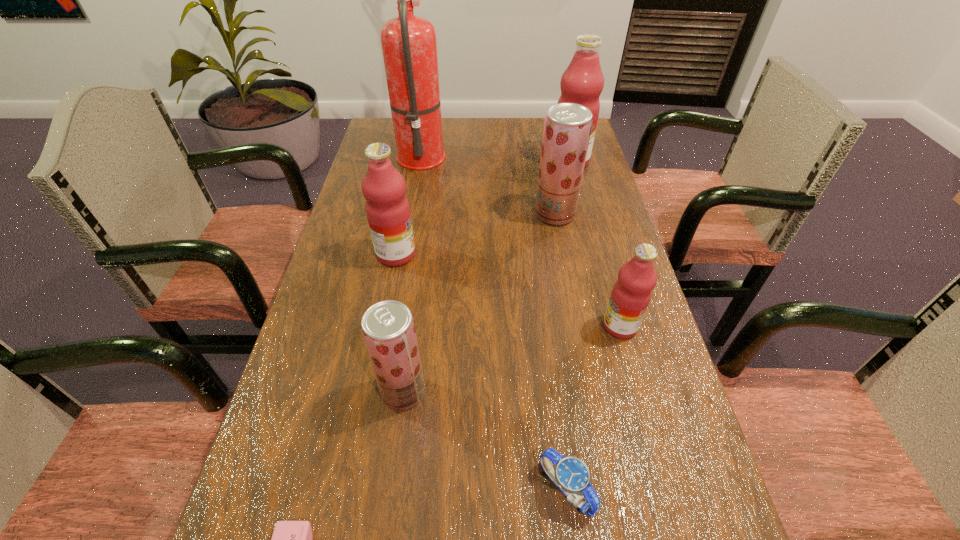
This screenshot has height=540, width=960. In order to click on vacant space at the left edge of the desktop in this screenshot , I will do `click(352, 218)`.

The height and width of the screenshot is (540, 960). In the image, there is a desktop. Find the location of `vacant space at the right edge`. vacant space at the right edge is located at coordinates (633, 502).

Find the location of `vacant region at the far left corner of the desktop`. vacant region at the far left corner of the desktop is located at coordinates (394, 147).

The width and height of the screenshot is (960, 540). In order to click on free space that is in between the third farthest object and the tallest object in this screenshot , I will do `click(489, 184)`.

This screenshot has height=540, width=960. Find the location of `vacant area that lies between the left strawberry fruit juice and the farther strawberry fruit juice`. vacant area that lies between the left strawberry fruit juice and the farther strawberry fruit juice is located at coordinates (479, 303).

At what (x,y) coordinates should I click in order to perform the action: click on free space that is in between the fifth farthest object and the red fire extinguisher. Please return your answer as a coordinate pair (x, y). Image resolution: width=960 pixels, height=540 pixels. Looking at the image, I should click on (521, 240).

This screenshot has height=540, width=960. What are the coordinates of `vacant region between the red fire extinguisher and the second nearest object` in the screenshot? It's located at (493, 321).

Find the location of a particular element. Image resolution: width=960 pixels, height=540 pixels. object that is the closest one to the smaller strawberry fruit juice is located at coordinates (291, 539).

Locate which object is the third closest to the fourth farthest object. Please provide its 2D coordinates. Your answer should be formatted as a tuple, i.e. [(x, y)], where the tuple contains the x and y coordinates of a point satisfying the conditions above.

[(567, 127)]

At what (x,y) coordinates should I click in order to perform the action: click on fruit juice that is the third closest to the second nearest object. Please return your answer as a coordinate pair (x, y). Looking at the image, I should click on (388, 212).